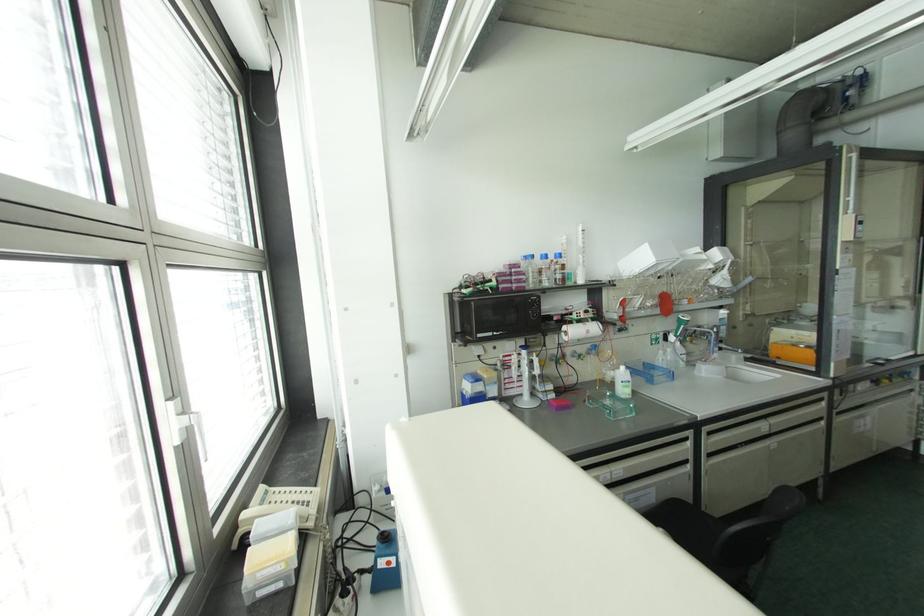
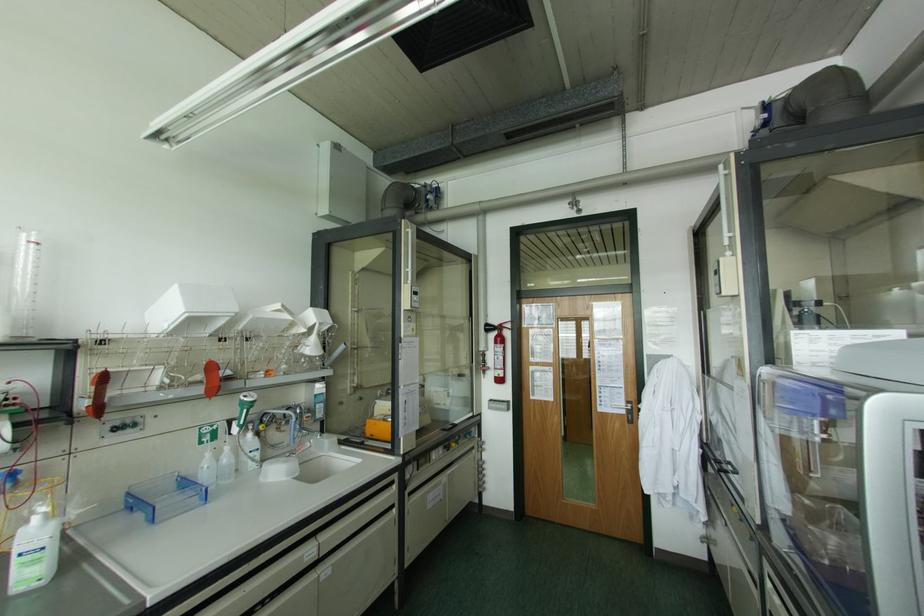
Question: I am providing you with two images of the same scene from different viewpoints. Which of the following objects are not visible in image2?

Choices:
 (A) clear squeeze bottle
 (B) red round knob
 (C) white pump dispenser
 (D) none of these

Answer: (D)